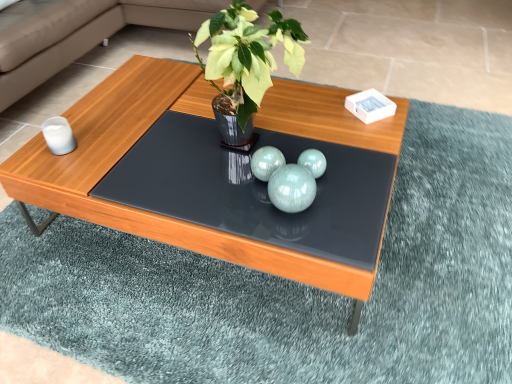
Question: Is shiny black glass table at center situated inside teal glossy spheres at center or outside?

Choices:
 (A) inside
 (B) outside

Answer: (B)

Question: Is shiny black glass table at center taller or shorter than teal glossy spheres at center?

Choices:
 (A) tall
 (B) short

Answer: (B)

Question: Which is nearer to the teal glossy spheres at center?

Choices:
 (A) green glossy vase at center
 (B) matte wooden coffee table at center
 (C) shiny black glass table at center

Answer: (C)

Question: Estimate the real-world distances between objects in this image. Which object is farther from the matte wooden coffee table at center?

Choices:
 (A) teal glossy spheres at center
 (B) shiny black glass table at center
 (C) green glossy vase at center

Answer: (A)